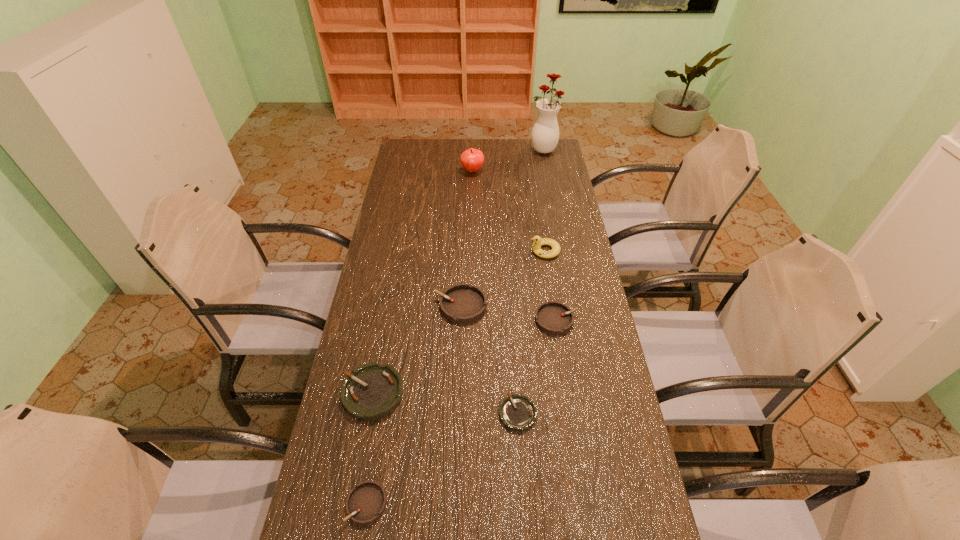
Find the location of a particular element. This screenshot has width=960, height=540. the left green ashtray is located at coordinates (372, 391).

Image resolution: width=960 pixels, height=540 pixels. In order to click on the smallest gray ashtray in this screenshot , I will do `click(366, 502)`.

This screenshot has width=960, height=540. I want to click on the nearest ashtray, so click(366, 502).

Locate an element on the screen. This screenshot has height=540, width=960. the smaller green ashtray is located at coordinates (518, 413).

At what (x,y) coordinates should I click in order to perform the action: click on the fourth ashtray from left to right. Please return your answer as a coordinate pair (x, y). Looking at the image, I should click on (518, 413).

The width and height of the screenshot is (960, 540). Identify the location of vacant area situated on the left of the vase. (483, 150).

Find the location of a particular element. The image size is (960, 540). free space located on the front of the seventh nearest object is located at coordinates (471, 196).

Where is `vacant space situated 0.290m on the face of the third farthest object`? The image size is (960, 540). vacant space situated 0.290m on the face of the third farthest object is located at coordinates (451, 251).

Where is `blank area located 0.150m on the face of the third farthest object`? The width and height of the screenshot is (960, 540). blank area located 0.150m on the face of the third farthest object is located at coordinates (489, 251).

Where is `vacant region located 0.050m on the face of the third farthest object`? This screenshot has height=540, width=960. vacant region located 0.050m on the face of the third farthest object is located at coordinates (516, 251).